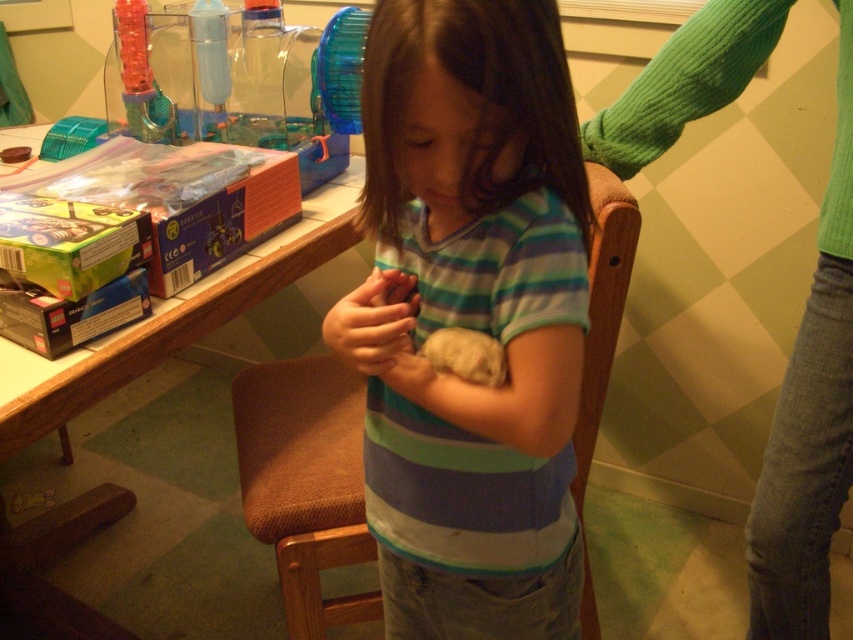
Who is lower down, striped cotton shirt at center or wooden table at upper left?

Positioned lower is striped cotton shirt at center.

Between striped cotton shirt at center and wooden table at upper left, which one is positioned higher?

Positioned higher is wooden table at upper left.

Is point (460, 131) farther from camera compared to point (184, 298)?

No, it is not.

What are the coordinates of `striped cotton shirt at center` in the screenshot? It's located at (469, 317).

Does point (495, 314) come in front of point (463, 362)?

Yes, it is in front of point (463, 362).

Can you confirm if striped cotton shirt at center is positioned below fuzzy beige hamster at upper center?

Correct, striped cotton shirt at center is located below fuzzy beige hamster at upper center.

Is point (498, 600) farther from viewer compared to point (460, 340)?

Yes, it is.

Locate an element on the screen. Image resolution: width=853 pixels, height=640 pixels. striped cotton shirt at center is located at coordinates (469, 317).

Does point (70, 355) come farther from viewer compared to point (426, 342)?

Yes, point (70, 355) is behind point (426, 342).

Is wooden table at upper left positioned behind fuzzy beige hamster at upper center?

Yes, it is behind fuzzy beige hamster at upper center.

Who is more forward, (x=258, y=268) or (x=491, y=337)?

Point (x=491, y=337)

The image size is (853, 640). I want to click on wooden table at upper left, so point(170,321).